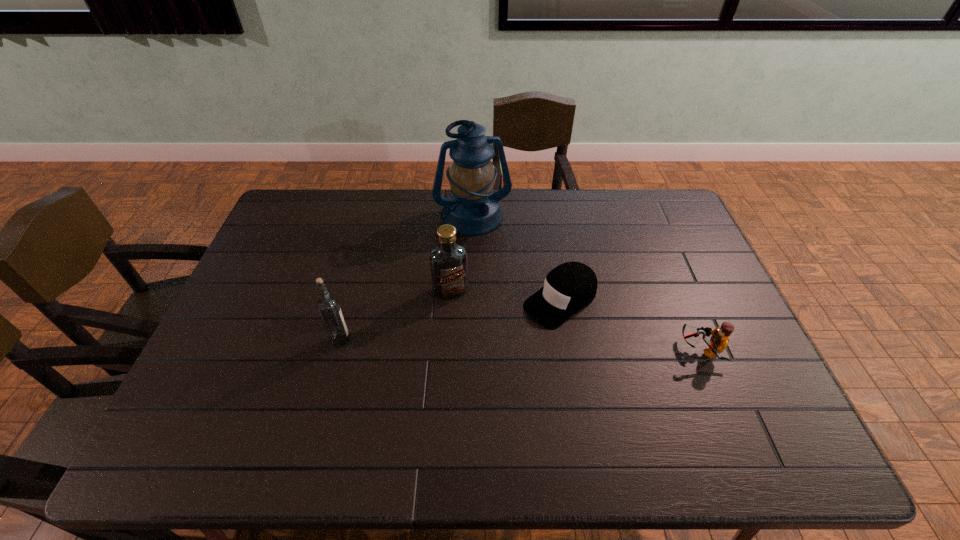
At what (x,y) coordinates should I click in order to perform the action: click on vacant region located 0.100m holding a crossbow in the hands of the second shortest object. Please return your answer as a coordinate pair (x, y). Looking at the image, I should click on (643, 349).

The width and height of the screenshot is (960, 540). Find the location of `vacant area located holding a crossbow in the hands of the second shortest object`. vacant area located holding a crossbow in the hands of the second shortest object is located at coordinates (658, 349).

Where is `free region located 0.340m holding a crossbow in the hands of the second shortest object`? The width and height of the screenshot is (960, 540). free region located 0.340m holding a crossbow in the hands of the second shortest object is located at coordinates (x=552, y=349).

Find the location of a particular element. This screenshot has height=540, width=960. free space located 0.370m on the face of the lantern is located at coordinates (509, 323).

Locate an element on the screen. Image resolution: width=960 pixels, height=540 pixels. vacant space located on the face of the lantern is located at coordinates (505, 310).

The width and height of the screenshot is (960, 540). I want to click on vacant point located 0.060m on the face of the lantern, so click(485, 249).

Find the location of a particular element. The height and width of the screenshot is (540, 960). free space located on the front-facing side of the cap is located at coordinates (512, 334).

The image size is (960, 540). I want to click on free region located 0.390m on the front-facing side of the cap, so click(x=418, y=400).

The height and width of the screenshot is (540, 960). Identify the location of vacant region located on the front-facing side of the cap. (469, 364).

Image resolution: width=960 pixels, height=540 pixels. I want to click on vacant space located 0.340m on the front-facing side of the right vodka, so click(x=496, y=401).